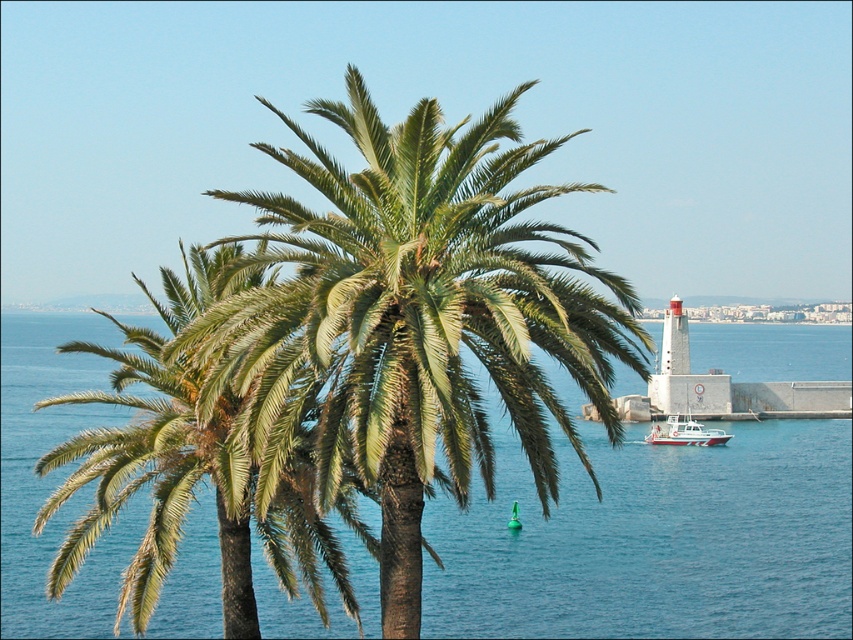
You are a photographer planning to capture the blue water at center and the green leafy palm at center in a single shot. Which object should you focus on first if you want to ensure both are in sharp focus?

The blue water at center has a larger size compared to green leafy palm at center, so focusing on the larger blue water at center first would help ensure both are in sharp focus.

You are planning to take a photo of the blue water at center and the green leafy palm tree at center. Which object should you focus on first if you want to capture both in a single frame without moving the camera?

The blue water at center has a larger size compared to the green leafy palm tree at center, so you should focus on the blue water at center first to ensure it fills the frame appropriately before adjusting for the palm tree.